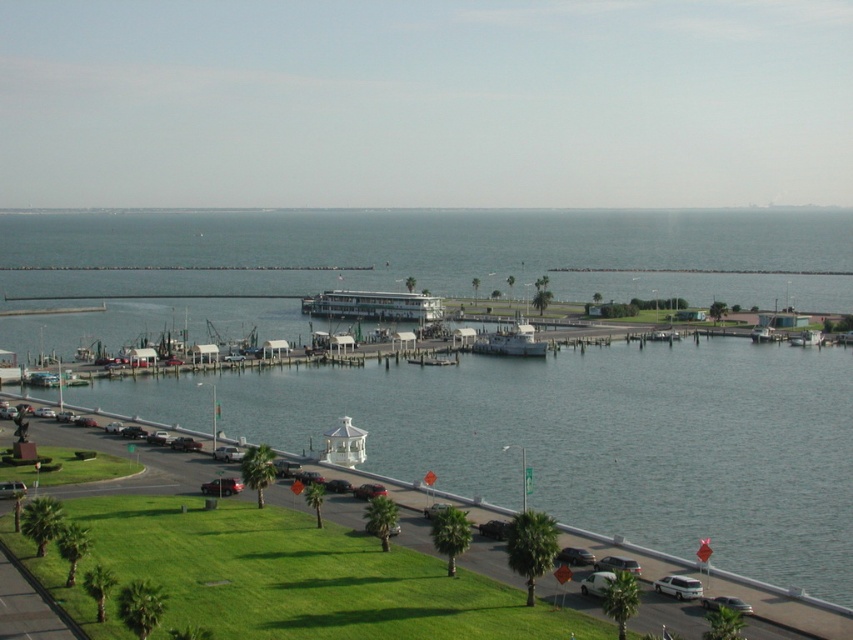
Which is behind, point (207, 481) or point (577, 552)?

Positioned behind is point (207, 481).

Which is more to the left, metallic silver sedan at lower center or metallic silver sedan at center?

metallic silver sedan at lower center

Which is behind, point (228, 477) or point (593, 563)?

The point (228, 477) is behind.

Where is `metallic silver sedan at lower center`? The image size is (853, 640). metallic silver sedan at lower center is located at coordinates (222, 486).

Who is higher up, white matte sedan at lower right or metallic silver sedan at lower right?

Positioned higher is white matte sedan at lower right.

Does white matte sedan at lower right have a larger size compared to metallic silver sedan at lower right?

Indeed, white matte sedan at lower right has a larger size compared to metallic silver sedan at lower right.

Between point (677, 584) and point (718, 598), which one is positioned in front?

Point (718, 598)

Identify the location of white matte sedan at lower right. (677, 586).

Does white glossy cruise ship at center have a larger size compared to metallic silver sedan at lower center?

Yes, white glossy cruise ship at center is bigger than metallic silver sedan at lower center.

Who is more distant from viewer, (300,308) or (201,490)?

Positioned behind is point (300,308).

Describe the element at coordinates (373, 305) in the screenshot. The image size is (853, 640). I see `white glossy cruise ship at center` at that location.

Identify the location of white glossy cruise ship at center. (373, 305).